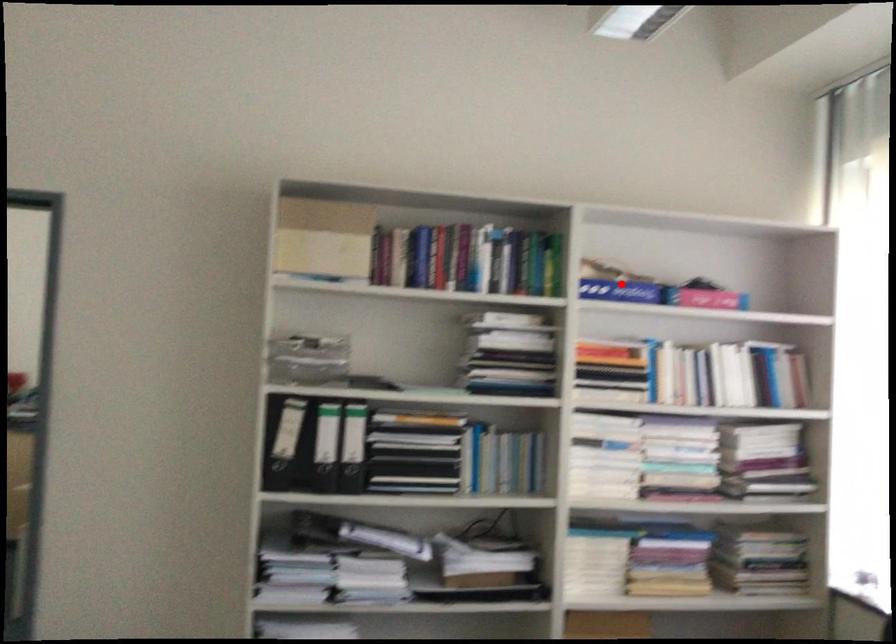
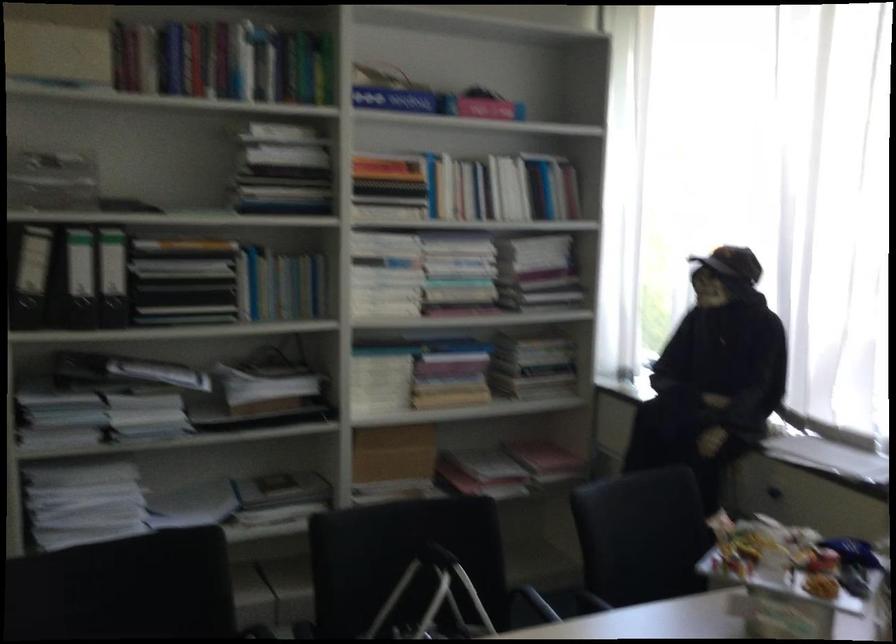
Where in the second image is the point corresponding to the highlighted location from the first image?

(393, 99)